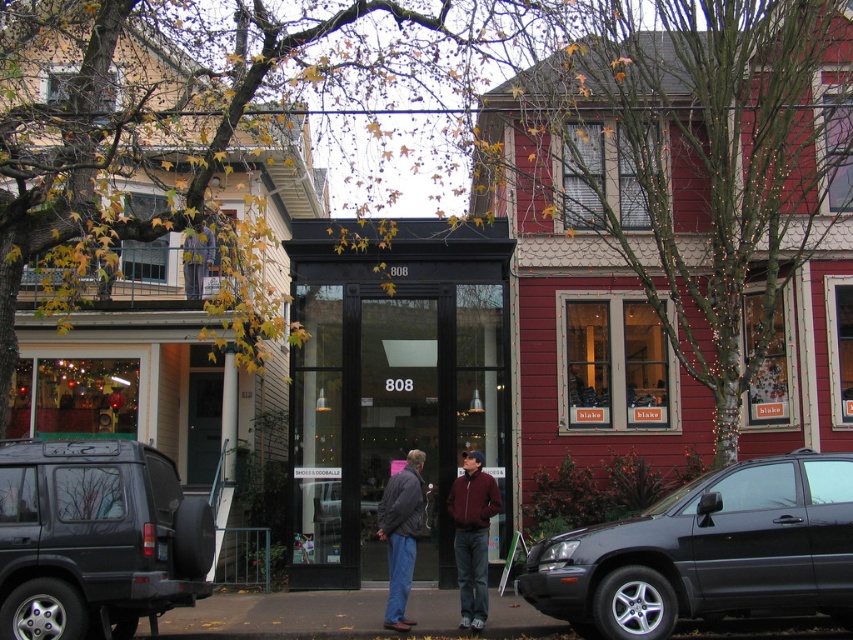
Question: Among these objects, which one is farthest from the camera?

Choices:
 (A) maroon fabric jacket at center
 (B) matte black suv at lower left
 (C) shiny black suv at lower right
 (D) dark gray jacket at center

Answer: (D)

Question: Which object is farther from the camera taking this photo?

Choices:
 (A) maroon fabric jacket at center
 (B) black glass storefront at center

Answer: (B)

Question: Is black glass storefront at center bigger than shiny black suv at lower right?

Choices:
 (A) no
 (B) yes

Answer: (B)

Question: Is shiny black suv at lower right wider than maroon fabric jacket at center?

Choices:
 (A) no
 (B) yes

Answer: (B)

Question: Estimate the real-world distances between objects in this image. Which object is farther from the matte black suv at lower left?

Choices:
 (A) dark gray jacket at center
 (B) shiny black suv at lower right

Answer: (B)

Question: Can you confirm if shiny black suv at lower right is positioned to the left of dark gray jacket at center?

Choices:
 (A) no
 (B) yes

Answer: (A)